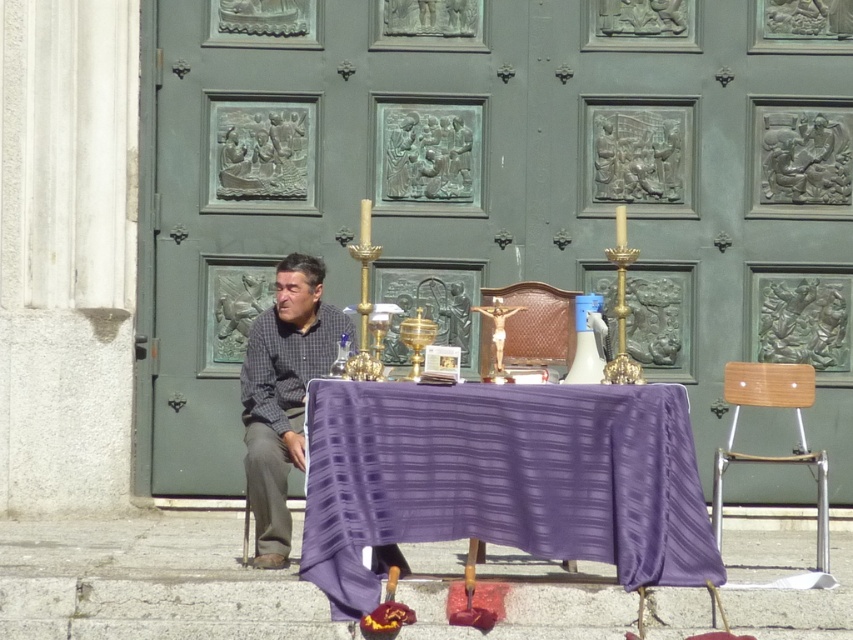
You are standing in front of the large green door and notice the gray checkered shirt at left. Based on its position, can you estimate how far it is from the bottom edge of the door?

The gray checkered shirt at left is positioned at coordinates point (283, 394). The y coordinate of 0.333 indicates it is approximately one third of the way from the bottom edge of the door.